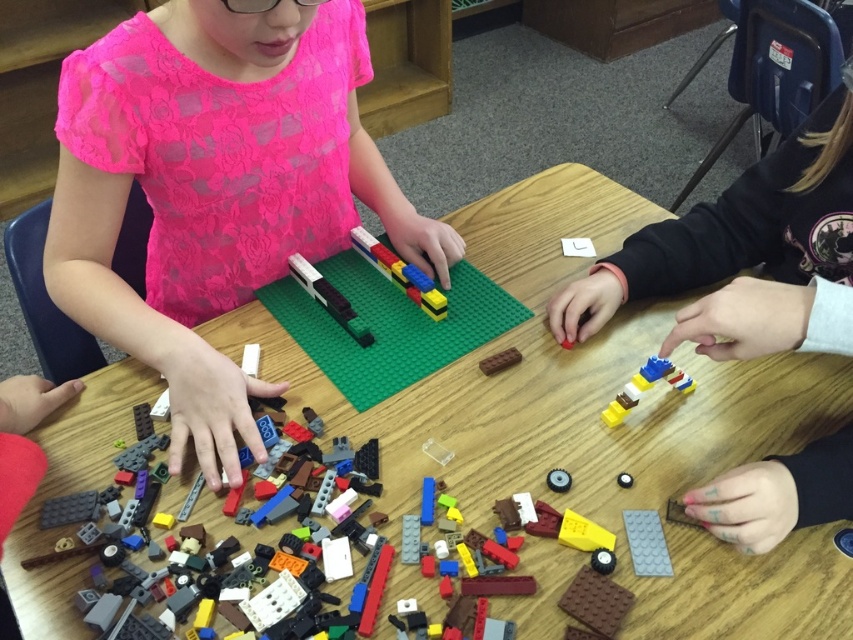
Question: Can you confirm if pink lace shirt at upper left is smaller than translucent plastic lego at center?

Choices:
 (A) yes
 (B) no

Answer: (B)

Question: Which point appears closest to the camera in this image?

Choices:
 (A) (115, 49)
 (B) (509, 364)

Answer: (A)

Question: Does translucent plastic lego at center have a larger size compared to brown matte brick at center?

Choices:
 (A) yes
 (B) no

Answer: (A)

Question: Among these points, which one is nearest to the camera?

Choices:
 (A) (360, 328)
 (B) (430, 307)

Answer: (A)

Question: Is translucent plastic lego at center above brown matte brick at center?

Choices:
 (A) yes
 (B) no

Answer: (B)

Question: Estimate the real-world distances between objects in this image. Which object is closer to the brown matte brick at center?

Choices:
 (A) wooden table at center
 (B) pink lace shirt at upper left
 (C) metallic silver gear at center

Answer: (C)